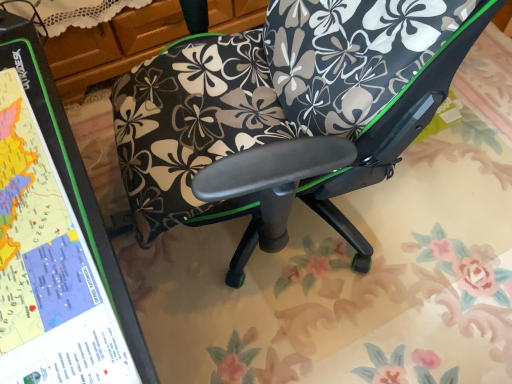
Where is `vacant space underneath green matte map at left (from a real-world perspective)`? This screenshot has height=384, width=512. vacant space underneath green matte map at left (from a real-world perspective) is located at coordinates (46, 290).